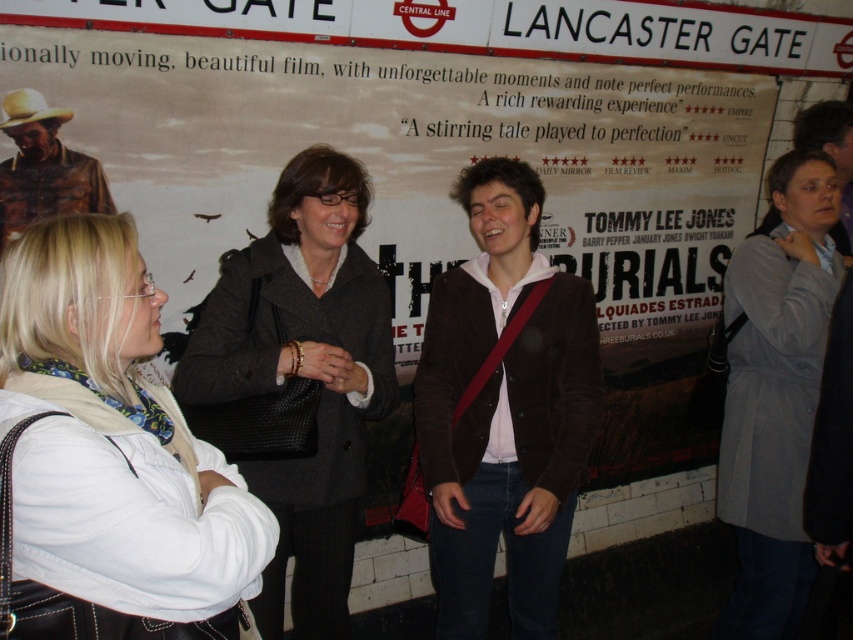
Can you confirm if white leather jacket at lower left is shorter than dark gray wool coat at center?

Yes.

Which is above, white leather jacket at lower left or dark gray wool coat at center?

white leather jacket at lower left is higher up.

This screenshot has height=640, width=853. What do you see at coordinates (111, 456) in the screenshot?
I see `white leather jacket at lower left` at bounding box center [111, 456].

The width and height of the screenshot is (853, 640). I want to click on white leather jacket at lower left, so click(111, 456).

Between point (451, 403) and point (764, 448), which one is positioned in front?

Point (451, 403) is more forward.

Does brown corduroy jacket at center have a greater width compared to gray fabric coat at right?

Yes, brown corduroy jacket at center is wider than gray fabric coat at right.

Between point (473, 369) and point (740, 289), which one is positioned behind?

The point (740, 289) is behind.

The width and height of the screenshot is (853, 640). I want to click on brown corduroy jacket at center, so click(503, 410).

Can you confirm if dark gray wool coat at center is bigger than rustic leather jacket at left?

Yes, dark gray wool coat at center is bigger than rustic leather jacket at left.

Who is more distant from viewer, (331, 401) or (73, 173)?

Point (73, 173)

Locate an element on the screen. Image resolution: width=853 pixels, height=640 pixels. dark gray wool coat at center is located at coordinates (300, 378).